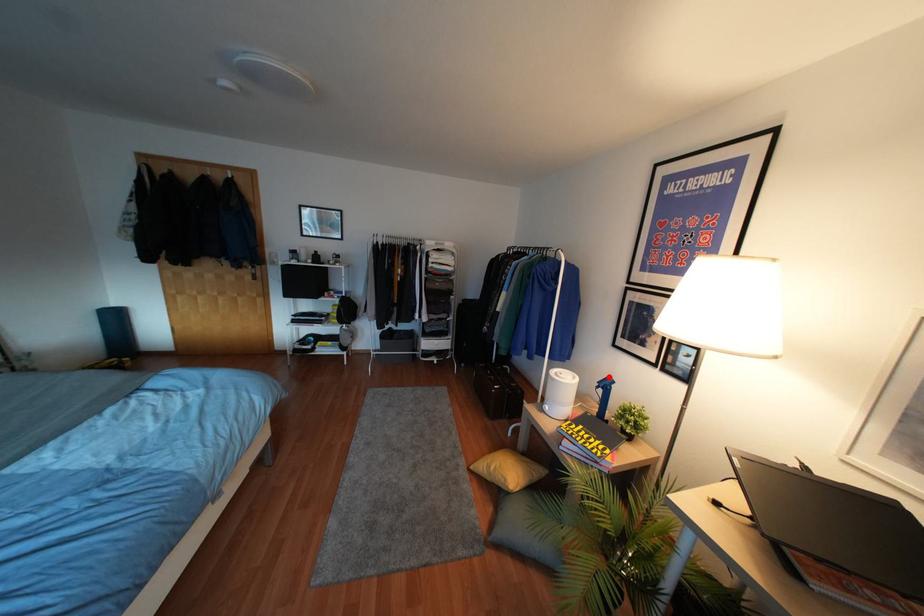
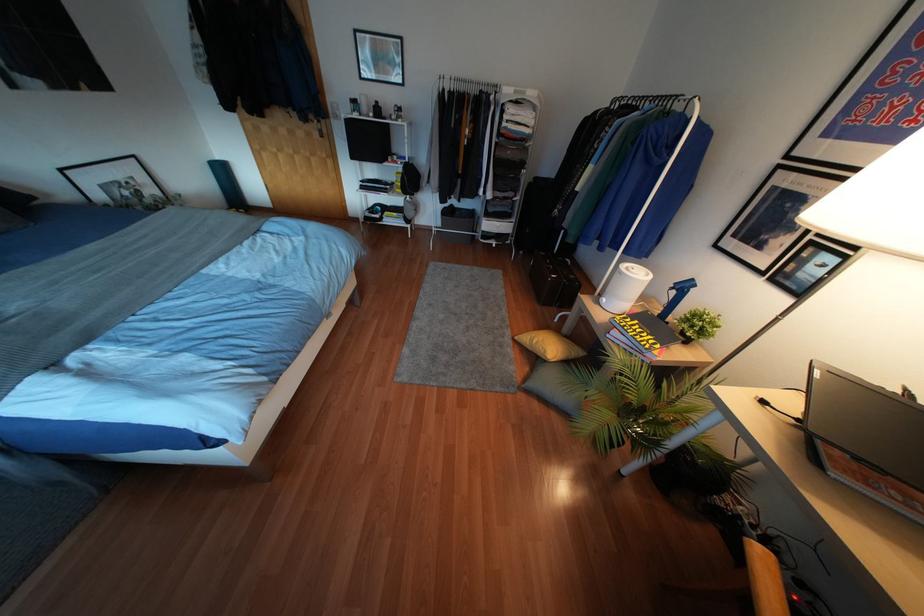
In the second image, find the point that corresponds to the highlighted location in the first image.

(690, 280)